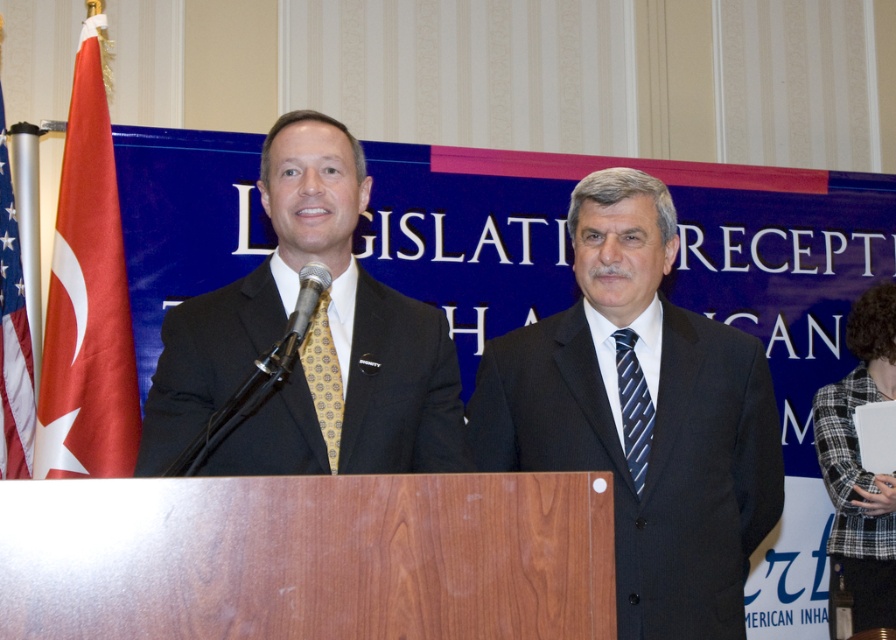
You are a photographer at the event and need to capture a photo that includes both the plaid wool jacket at lower right and the metallic gold tie at center. Based on their positions, which one should you ensure is closer to the right edge of the frame?

The plaid wool jacket at lower right is positioned on the right side of the metallic gold tie at center, so to include both in the photo, the plaid wool jacket at lower right should be closer to the right edge of the frame.

You are attending the legislative reception and notice the red fabric flag at left and the blue striped tie at right. Which object is taller?

The red fabric flag at left is taller than the blue striped tie at right.

You are a photographer at the event and need to position yourself to capture both the matte black suit at center and the american flag at left in the same frame. Given that your camera has a maximum focal length allowing a field of view that can cover 4 feet between subjects, will you be able to include both in the shot?

The distance between the matte black suit at center and the american flag at left is 3.97 feet, which is within the camera field of view of 4 feet. Therefore, both subjects can be captured in the same frame.